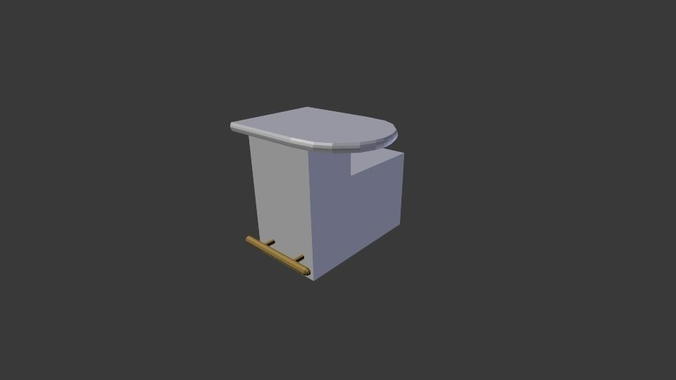
The width and height of the screenshot is (676, 380). Identify the location of surface. (289, 127).